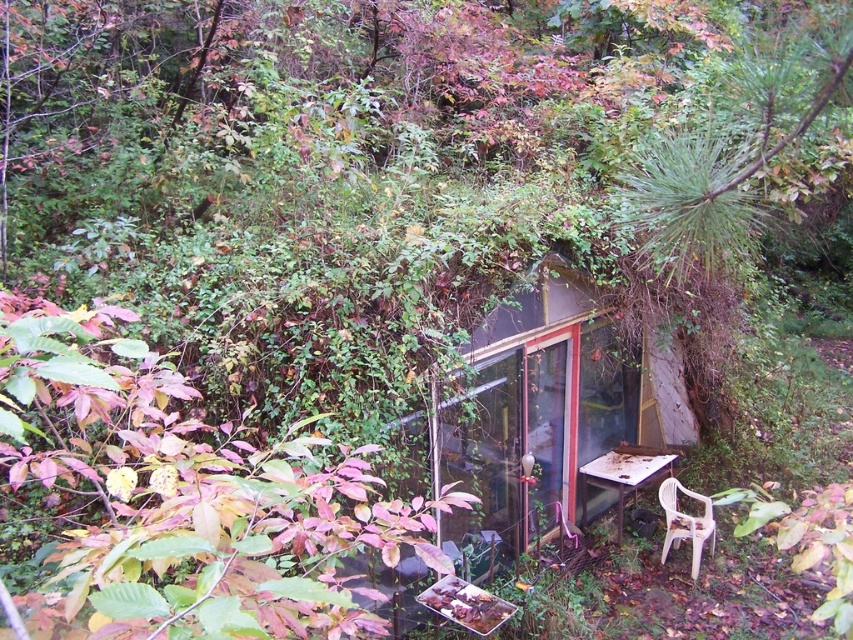
You are a hiker who has stumbled upon this forest scene. You need to decide whether to take shelter in the transparent glass hut at center or sit at the rusty metal table at lower right. Based on their positions, which one is closer to the path that leads back to the trailhead? Please explain your reasoning.

The transparent glass hut at center is positioned on the left side of the rusty metal table at lower right. Since the path leading back to the trailhead is likely near the structure, the transparent glass hut at center would be closer to the path compared to the rusty metal table at lower right, making it the better choice for shelter.

You are a hiker who has stumbled upon this abandoned greenhouse. You need to sit down to rest. The rusty metal table at lower right and the white plastic chair at lower right are the only available furniture. Which one is wider, and can you sit comfortably on the one that is wider?

The rusty metal table at lower right is wider than the white plastic chair at lower right. Since the table is wider, you can sit comfortably on it while resting.